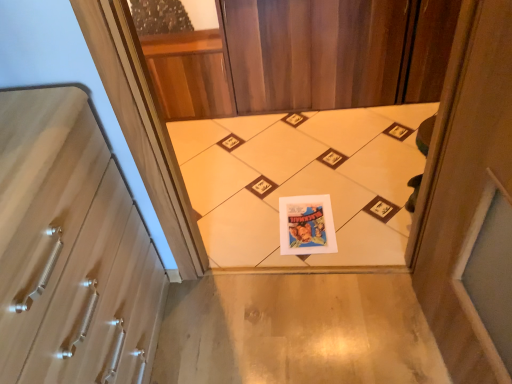
Question: Should I look upward or downward to see wooden at left?

Choices:
 (A) down
 (B) up

Answer: (A)

Question: Is wooden at left in front of white paper print at center?

Choices:
 (A) yes
 (B) no

Answer: (A)

Question: From the image's perspective, is wooden at left over white paper print at center?

Choices:
 (A) no
 (B) yes

Answer: (A)

Question: Does wooden at left have a lesser width compared to white paper print at center?

Choices:
 (A) yes
 (B) no

Answer: (A)

Question: From a real-world perspective, is wooden at left located beneath white paper print at center?

Choices:
 (A) no
 (B) yes

Answer: (A)

Question: Can you confirm if wooden at left is shorter than white paper print at center?

Choices:
 (A) no
 (B) yes

Answer: (A)

Question: Does wooden at left have a larger size compared to white paper print at center?

Choices:
 (A) no
 (B) yes

Answer: (B)

Question: Can you confirm if white paper print at center is shorter than wooden at left?

Choices:
 (A) no
 (B) yes

Answer: (B)

Question: Does white paper print at center have a greater width compared to wooden at left?

Choices:
 (A) yes
 (B) no

Answer: (A)

Question: Is wooden at left completely or partially inside white paper print at center?

Choices:
 (A) no
 (B) yes

Answer: (A)

Question: Is white paper print at center not within wooden at left?

Choices:
 (A) no
 (B) yes

Answer: (B)

Question: Does white paper print at center have a larger size compared to wooden at left?

Choices:
 (A) yes
 (B) no

Answer: (B)

Question: From the image's perspective, is white paper print at center under wooden at left?

Choices:
 (A) yes
 (B) no

Answer: (B)

Question: Considering the relative positions of wooden at left and white paper print at center in the image provided, is wooden at left to the left or to the right of white paper print at center?

Choices:
 (A) right
 (B) left

Answer: (B)